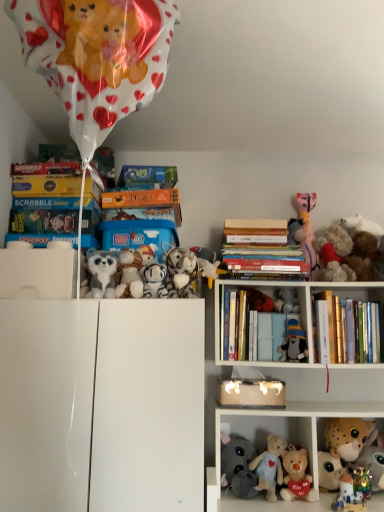
At what (x,y) coordinates should I click in order to perform the action: click on vacant space situated above hardcover books at center, which is counted as the third book, starting from the top (from a real-world perspective). Please return your answer as a coordinate pair (x, y). Looking at the image, I should click on (263, 242).